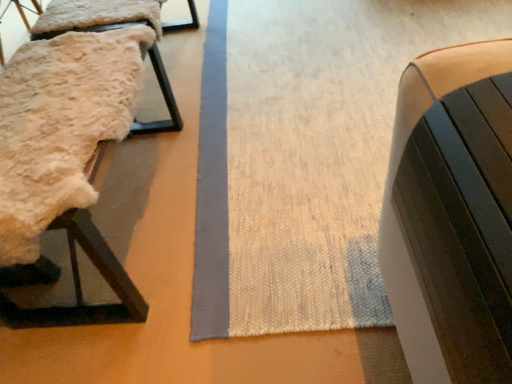
The width and height of the screenshot is (512, 384). I want to click on matte black bench at right, the first furniture from the front, so click(x=452, y=215).

What is the approximate height of fuzzy sheepskin at left, acting as the 1th furniture starting from the back?

It is 19.75 inches.

I want to click on matte black bench at right, which is the 3th furniture in left-to-right order, so click(x=452, y=215).

From the image's perspective, is fuzzy sheepskin at left, acting as the 1th furniture starting from the back, below fluffy sheepskin at left, acting as the 3th furniture starting from the right?

No, from the image's perspective, fuzzy sheepskin at left, acting as the 1th furniture starting from the back, is not below fluffy sheepskin at left, acting as the 3th furniture starting from the right.

In the image, is fuzzy sheepskin at left, marked as the second furniture in a right-to-left arrangement, positioned in front of or behind fluffy sheepskin at left, acting as the 3th furniture starting from the right?

In the image, fuzzy sheepskin at left, marked as the second furniture in a right-to-left arrangement, appears behind fluffy sheepskin at left, acting as the 3th furniture starting from the right.

Considering the sizes of objects fuzzy sheepskin at left, acting as the 1th furniture starting from the back, and fluffy sheepskin at left, positioned as the first furniture in left-to-right order, in the image provided, who is thinner, fuzzy sheepskin at left, acting as the 1th furniture starting from the back, or fluffy sheepskin at left, positioned as the first furniture in left-to-right order,?

Thinner between the two is fuzzy sheepskin at left, acting as the 1th furniture starting from the back.

Between matte black bench at right, which ranks as the 3th furniture in back-to-front order, and fuzzy sheepskin at left, marked as the second furniture in a right-to-left arrangement, which one appears on the right side from the viewer's perspective?

matte black bench at right, which ranks as the 3th furniture in back-to-front order, is more to the right.

Is point (399, 326) closer or farther from the camera than point (157, 71)?

Clearly, point (399, 326) is closer to the camera than point (157, 71).

Which furniture is the 2nd one when counting from the back of the matte black bench at right, which is the 3th furniture in left-to-right order? Please provide its 2D coordinates.

[(165, 101)]

Between fluffy sheepskin at left, positioned as the first furniture in left-to-right order, and matte black bench at right, the first furniture from the front, which one has larger size?

Bigger between the two is fluffy sheepskin at left, positioned as the first furniture in left-to-right order.

At what (x,y) coordinates should I click in order to perform the action: click on the 1st furniture located beneath the matte black bench at right, the first furniture from the front (from a real-world perspective). Please return your answer as a coordinate pair (x, y). Looking at the image, I should click on (80, 284).

Can we say fluffy sheepskin at left, positioned as the first furniture in left-to-right order, lies outside matte black bench at right, the 1th furniture in the right-to-left sequence?

fluffy sheepskin at left, positioned as the first furniture in left-to-right order, lies outside matte black bench at right, the 1th furniture in the right-to-left sequence,'s area.

Is matte black bench at right, the first furniture from the front, at the back of fluffy sheepskin at left, marked as the second furniture in a front-to-back arrangement?

That's not correct — fluffy sheepskin at left, marked as the second furniture in a front-to-back arrangement, is not looking away from matte black bench at right, the first furniture from the front.

Does point (0, 312) come farther from viewer compared to point (51, 37)?

No, it is not.

Can you tell me how much fluffy sheepskin at left, acting as the 3th furniture starting from the right, and fuzzy sheepskin at left, marked as the 3th furniture in a front-to-back arrangement, differ in facing direction?

They differ by 1.77 degrees in their facing directions.

In the scene shown: From the image's perspective, is fluffy sheepskin at left, acting as the 3th furniture starting from the right, located above fuzzy sheepskin at left, marked as the second furniture in a right-to-left arrangement?

Incorrect, from the image's perspective, fluffy sheepskin at left, acting as the 3th furniture starting from the right, is lower than fuzzy sheepskin at left, marked as the second furniture in a right-to-left arrangement.

In the image, there is a fluffy sheepskin at left, marked as the second furniture in a back-to-front arrangement. Identify the location of furniture below it (from a real-world perspective). (165, 101).

Is fuzzy sheepskin at left, acting as the 1th furniture starting from the back, taller than matte black bench at right, the 1th furniture in the right-to-left sequence?

Correct, fuzzy sheepskin at left, acting as the 1th furniture starting from the back, is much taller as matte black bench at right, the 1th furniture in the right-to-left sequence.

From the image's perspective, is fuzzy sheepskin at left, acting as the 1th furniture starting from the back, on matte black bench at right, the first furniture from the front?

Yes, from the image's perspective, fuzzy sheepskin at left, acting as the 1th furniture starting from the back, is over matte black bench at right, the first furniture from the front.

Does fuzzy sheepskin at left, marked as the second furniture in a right-to-left arrangement, touch matte black bench at right, which is the 3th furniture in left-to-right order?

fuzzy sheepskin at left, marked as the second furniture in a right-to-left arrangement, is not next to matte black bench at right, which is the 3th furniture in left-to-right order, and they're not touching.

From a real-world perspective, is fuzzy sheepskin at left, acting as the 1th furniture starting from the back, above or below matte black bench at right, the first furniture from the front?

fuzzy sheepskin at left, acting as the 1th furniture starting from the back, is below matte black bench at right, the first furniture from the front.

Which object is more forward, matte black bench at right, the first furniture from the front, or fluffy sheepskin at left, marked as the second furniture in a back-to-front arrangement?

matte black bench at right, the first furniture from the front, is more forward.

Is fluffy sheepskin at left, positioned as the first furniture in left-to-right order, completely or partially inside matte black bench at right, the first furniture from the front?

No, fluffy sheepskin at left, positioned as the first furniture in left-to-right order, is not inside matte black bench at right, the first furniture from the front.

Is matte black bench at right, the 1th furniture in the right-to-left sequence, wider than fluffy sheepskin at left, marked as the second furniture in a front-to-back arrangement?

In fact, matte black bench at right, the 1th furniture in the right-to-left sequence, might be narrower than fluffy sheepskin at left, marked as the second furniture in a front-to-back arrangement.

Is point (446, 266) less distant than point (51, 275)?

That is True.

Identify the location of furniture above the fluffy sheepskin at left, marked as the second furniture in a front-to-back arrangement (from the image's perspective). Image resolution: width=512 pixels, height=384 pixels. (165, 101).

The height and width of the screenshot is (384, 512). Find the location of `the 2nd furniture located beneath the matte black bench at right, which is the 3th furniture in left-to-right order (from a real-world perspective)`. the 2nd furniture located beneath the matte black bench at right, which is the 3th furniture in left-to-right order (from a real-world perspective) is located at coordinates (165, 101).

Which object lies further to the anchor point fluffy sheepskin at left, acting as the 3th furniture starting from the right, fuzzy sheepskin at left, marked as the second furniture in a right-to-left arrangement, or matte black bench at right, the 1th furniture in the right-to-left sequence?

matte black bench at right, the 1th furniture in the right-to-left sequence, lies further to fluffy sheepskin at left, acting as the 3th furniture starting from the right, than the other object.

Looking at the image, which one is located further to fuzzy sheepskin at left, marked as the 3th furniture in a front-to-back arrangement, fluffy sheepskin at left, positioned as the first furniture in left-to-right order, or matte black bench at right, the first furniture from the front?

matte black bench at right, the first furniture from the front, is further to fuzzy sheepskin at left, marked as the 3th furniture in a front-to-back arrangement.

Based on the photo, considering their positions, is matte black bench at right, the first furniture from the front, positioned closer to fluffy sheepskin at left, acting as the 3th furniture starting from the right, than fuzzy sheepskin at left, acting as the 1th furniture starting from the back?

fuzzy sheepskin at left, acting as the 1th furniture starting from the back, is closer to fluffy sheepskin at left, acting as the 3th furniture starting from the right.

When comparing their distances from matte black bench at right, the first furniture from the front, does fluffy sheepskin at left, marked as the second furniture in a back-to-front arrangement, or fuzzy sheepskin at left, acting as the 1th furniture starting from the back, seem closer?

fluffy sheepskin at left, marked as the second furniture in a back-to-front arrangement, is positioned closer to the anchor matte black bench at right, the first furniture from the front.

Estimate the real-world distances between objects in this image. Which object is further from matte black bench at right, which ranks as the 3th furniture in back-to-front order, fuzzy sheepskin at left, acting as the 1th furniture starting from the back, or fluffy sheepskin at left, marked as the second furniture in a back-to-front arrangement?

fuzzy sheepskin at left, acting as the 1th furniture starting from the back, is positioned further to the anchor matte black bench at right, which ranks as the 3th furniture in back-to-front order.

Which object lies nearer to the anchor point fuzzy sheepskin at left, acting as the 1th furniture starting from the back, matte black bench at right, which ranks as the 3th furniture in back-to-front order, or fluffy sheepskin at left, acting as the 3th furniture starting from the right?

Based on the image, fluffy sheepskin at left, acting as the 3th furniture starting from the right, appears to be nearer to fuzzy sheepskin at left, acting as the 1th furniture starting from the back.

Locate an element on the screen. Image resolution: width=512 pixels, height=384 pixels. furniture between matte black bench at right, the first furniture from the front, and fuzzy sheepskin at left, marked as the second furniture in a right-to-left arrangement, along the z-axis is located at coordinates (80, 284).